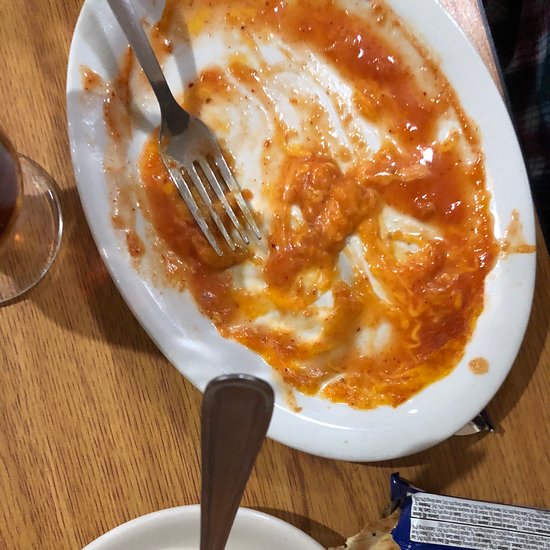
I want to click on white ceramic dish, so click(478, 102), click(249, 525).